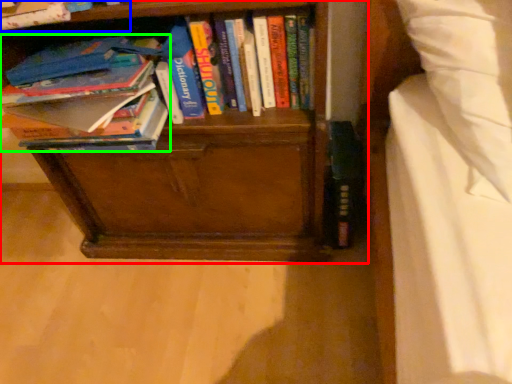
Question: Based on their relative distances, which object is farther from bookcase (highlighted by a red box)? Choose from book (highlighted by a blue box) and book (highlighted by a green box).

Choices:
 (A) book
 (B) book

Answer: (A)